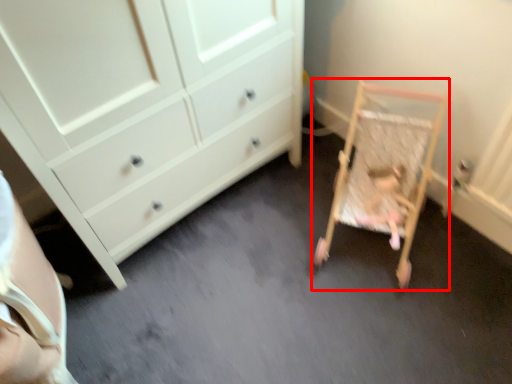
Question: Observing the image, what is the correct spatial positioning of furniture (annotated by the red box) in reference to person?

Choices:
 (A) right
 (B) left

Answer: (B)